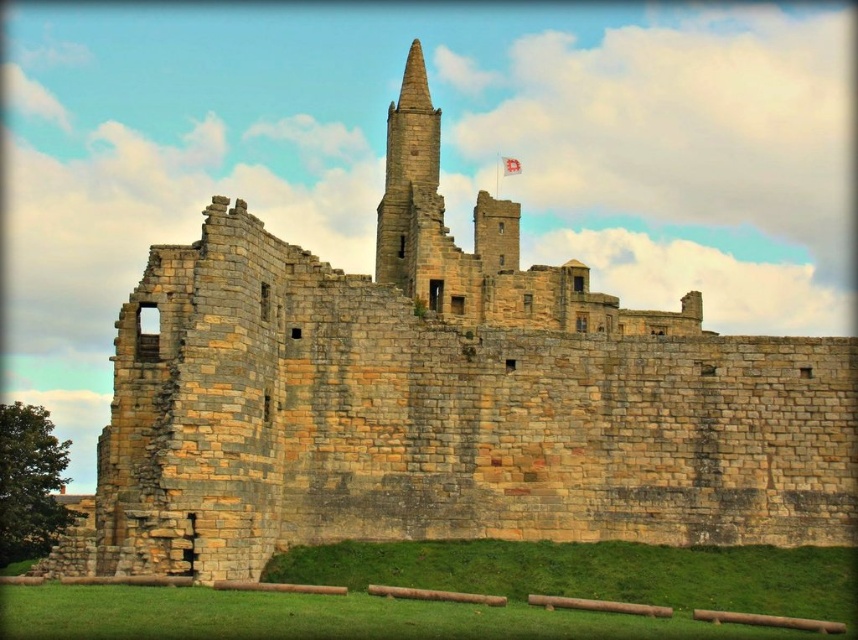
You are a tourist standing at the base of the stone spire at center in the medieval castle ruins. You want to take a photo of the entire spire without any obstructions. Considering your camera can capture a maximum distance of 100 meters, will you be able to take the photo from your current position?

The stone spire at center and viewer are 102.23 meters apart. Since your camera can only capture up to 100 meters, you are 2.23 meters beyond the maximum range. Move closer to ensure the entire spire is in frame.

You are a medieval knight standing at the base of the stone spire at center. You notice the white fabric flag at upper center flying in the wind. If you want to grab the flag, can you reach it without climbing the spire?

The stone spire at center is wider than the white fabric flag at upper center, but the flag is located at the upper part of the spire. Since you are at the base, you cannot reach the flag without climbing the spire.

What are the coordinates of the stone spire at center?

The stone spire at center is located at coordinates point (405,163).